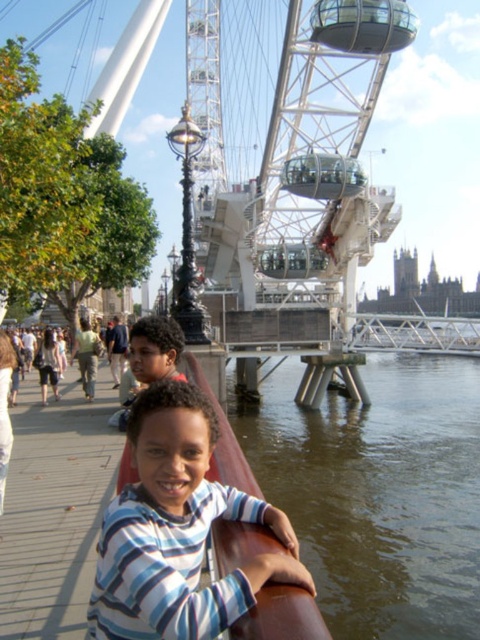
Question: Is white metallic ferris wheel at center wider than matte brown hair at center?

Choices:
 (A) no
 (B) yes

Answer: (B)

Question: Which is farther from the striped cotton shirt at center?

Choices:
 (A) white metallic ferris wheel at center
 (B) brown water at lower right
 (C) matte brown hair at center

Answer: (A)

Question: Considering the real-world distances, which object is closest to the striped cotton shirt at center?

Choices:
 (A) white metallic ferris wheel at center
 (B) brown water at lower right

Answer: (B)

Question: Which of the following is the closest to the observer?

Choices:
 (A) (468, 476)
 (B) (180, 332)

Answer: (B)

Question: Can you confirm if striped cotton shirt at center is positioned below matte brown hair at center?

Choices:
 (A) yes
 (B) no

Answer: (A)

Question: Does brown water at lower right have a greater width compared to matte brown hair at center?

Choices:
 (A) no
 (B) yes

Answer: (B)